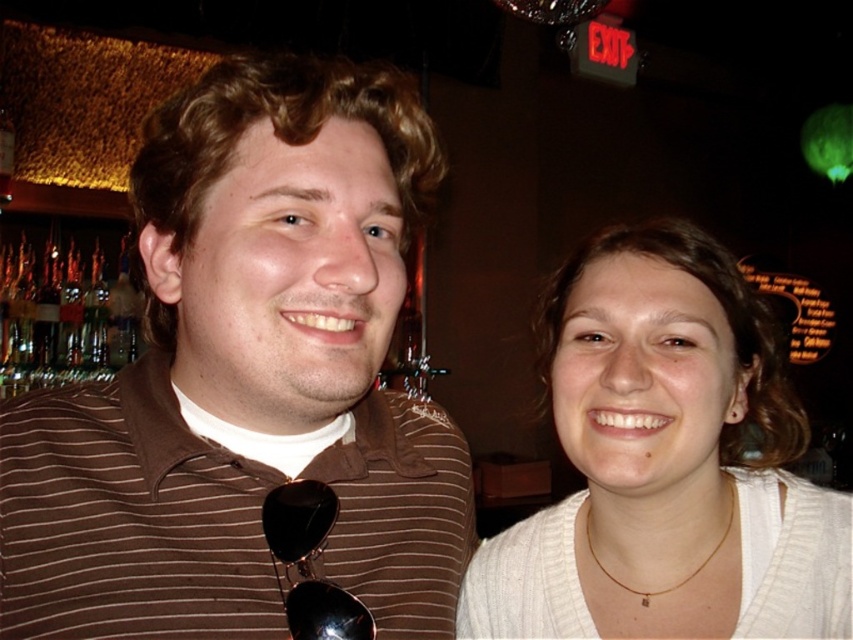
You are a photographer at a social event and need to capture both the brown striped shirt at left and the white knitwear at right in a single frame. Based on their positions, which one should you focus on first to ensure both are in focus?

The brown striped shirt at left is located above the white knitwear at right, so focusing on the brown striped shirt at left first will help ensure both are in focus as it is higher in the frame.

From the picture: You are at a bar and want to place a small decorative item between the two points, point (x=376, y=486) and point (x=686, y=234). Given that the item must be placed closer to the viewer, which point should you choose?

You should place the item closer to point (x=376, y=486) because it is closer to the viewer than point (x=686, y=234).

You are at a bar and want to place a small coaster at the exact location of point (247, 380). Which object should you place it on?

The point (247, 380) is on the brown striped shirt at left, so you should place the coaster on the brown striped shirt at left.